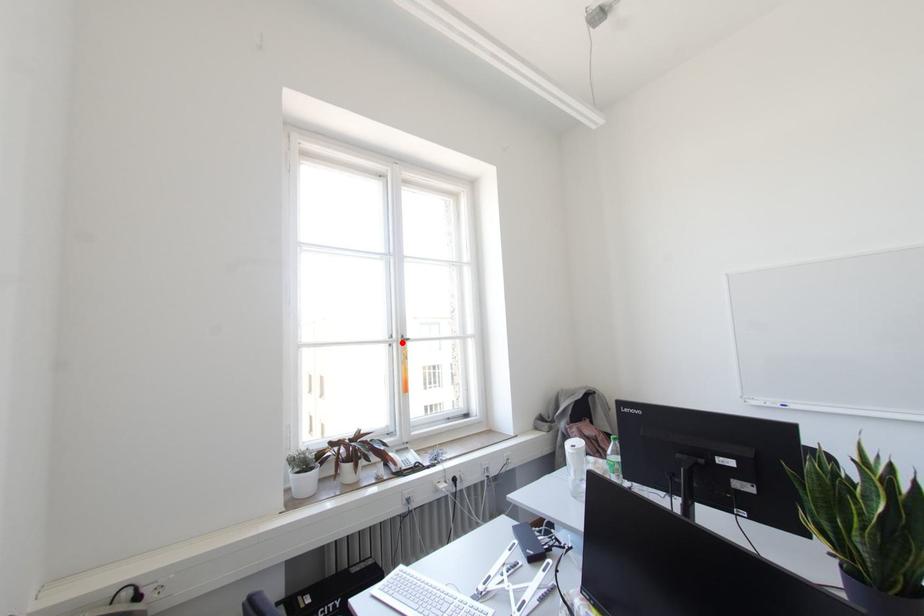
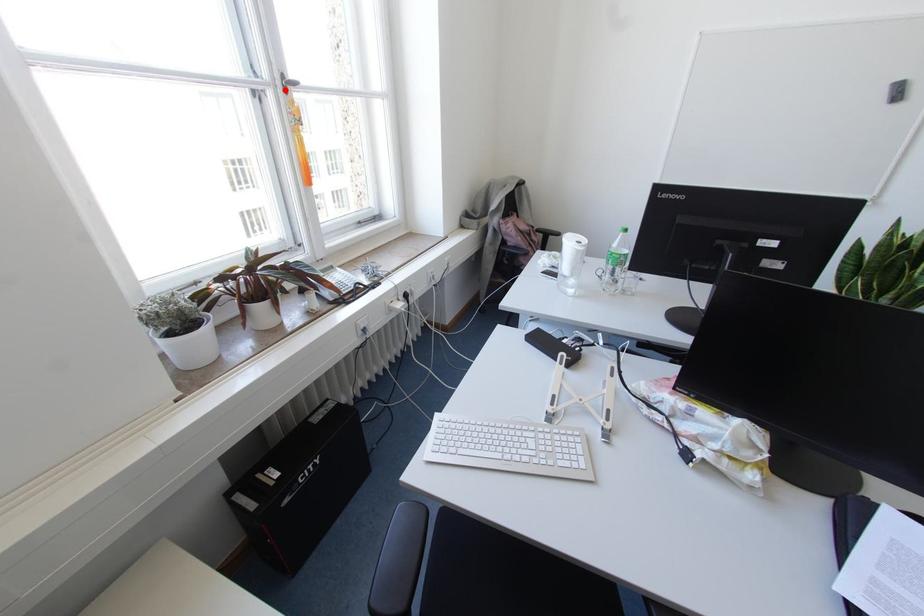
I am providing you with two images of the same scene from different viewpoints. A red point is marked on the first image and another point is marked on the second image. Do the highlighted points in image1 and image2 indicate the same real-world spot?

Yes